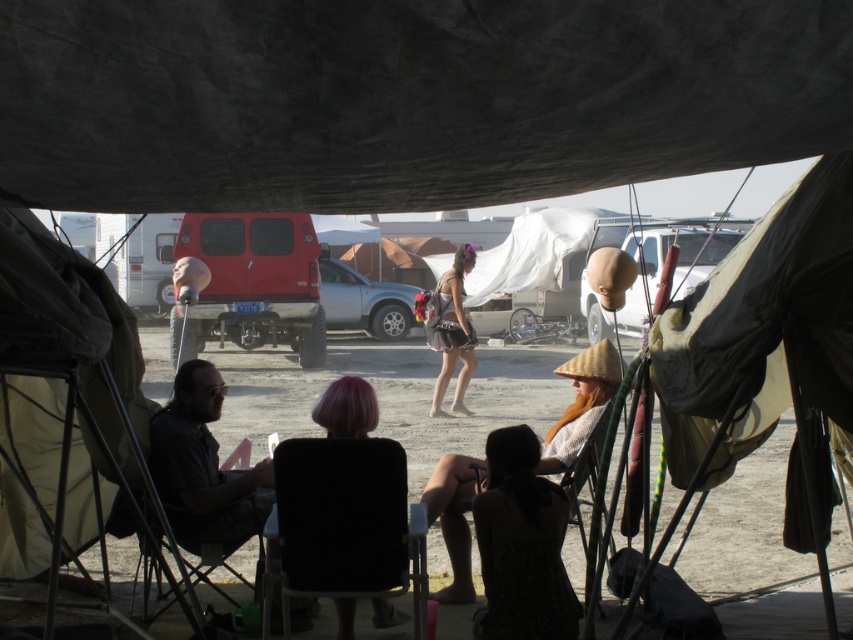
You are a photographer setting up a shot of the dark brown fabric dress at lower center and the beige straw hat at center. Which object should you focus on first if you want to capture both in the same frame without moving the camera?

You should focus on the dark brown fabric dress at lower center first because it is taller than the beige straw hat at center, so adjusting focus starting from the taller object ensures both are in frame.

You are standing in the outdoor scene under the canopy and want to take a photo of both the shiny metallic skirt at center and the silky pink hair at center. Which object should you focus on first to ensure both are in focus?

You should focus on the shiny metallic skirt at center first because it is closer to you than the silky pink hair at center, so focusing on it will help both objects be in focus.

Looking at this image, you are a photographer standing at the edge of the scene. You want to take a photo that includes both the shiny metallic skirt at center and the silky pink hair at center. Given that your camera has a maximum focus range of 7 meters, will both subjects be in focus?

The distance between the shiny metallic skirt at center and the silky pink hair at center is 7.58 meters, which exceeds the camera maximum focus range of 7 meters. Therefore, both subjects cannot be in focus at the same time.